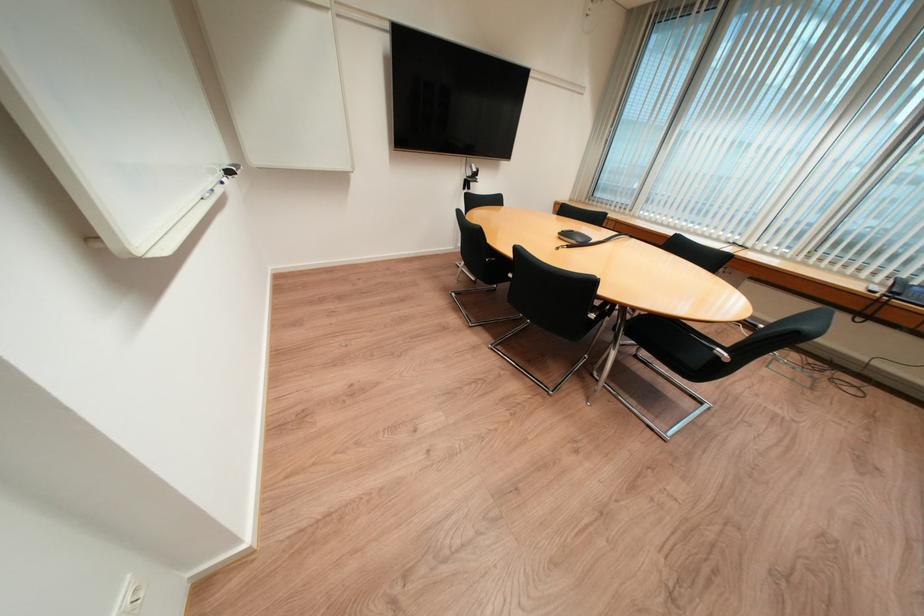
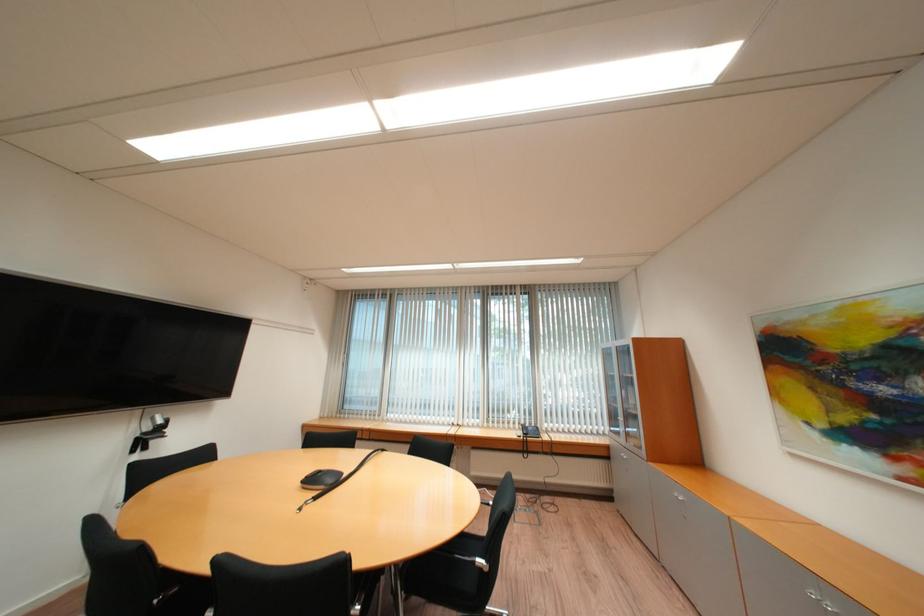
Locate, in the second image, the point that corresponds to [480,168] in the first image.

(162, 419)